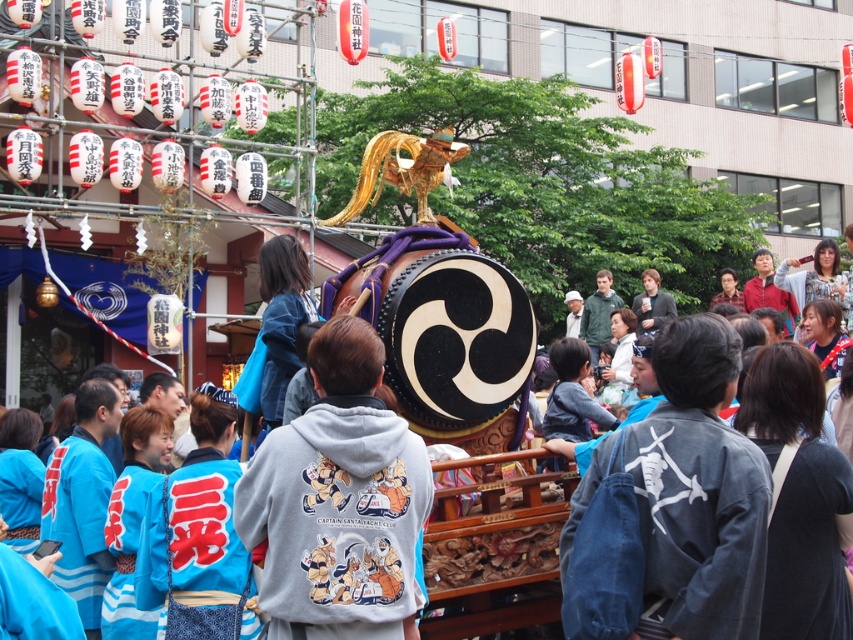
Which is behind, point (613, 300) or point (659, 294)?

The point (659, 294) is behind.

How far apart are green fabric jacket at center and matte black jacket at center?

green fabric jacket at center and matte black jacket at center are 9.22 feet apart.

Who is more distant from viewer, (602, 324) or (659, 307)?

Point (602, 324)

Find the location of a particular element. The image size is (853, 640). green fabric jacket at center is located at coordinates (598, 314).

Is black polished drum at center positioned in front of matte black jacket at center?

Yes.

Who is positioned more to the right, black polished drum at center or matte black jacket at center?

matte black jacket at center is more to the right.

Locate an element on the screen. black polished drum at center is located at coordinates (491, 600).

Between gray hoodie at center and black polished drum at center, which one has more height?

black polished drum at center

The width and height of the screenshot is (853, 640). What are the coordinates of `gray hoodie at center` in the screenshot? It's located at (338, 500).